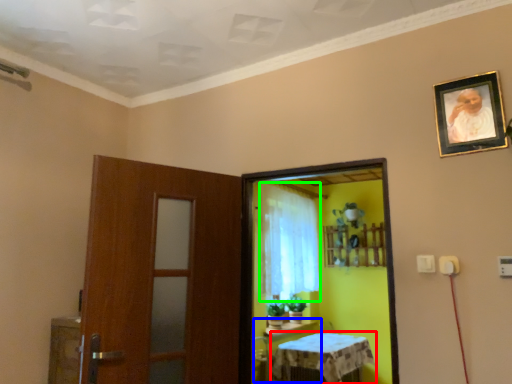
Question: Considering the real-world distances, which object is farthest from furniture (highlighted by a red box)? table (highlighted by a blue box) or curtain (highlighted by a green box)?

Choices:
 (A) table
 (B) curtain

Answer: (B)